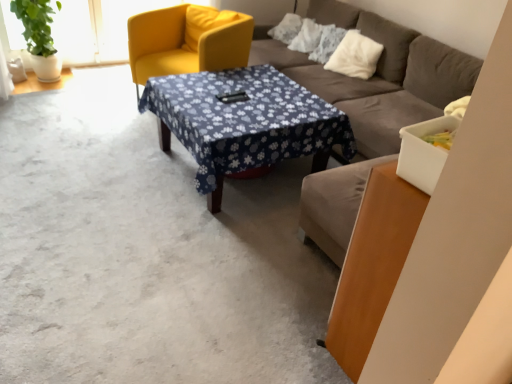
Question: From the image's perspective, is white fluffy pillow at upper right above or below brown fabric couch at center?

Choices:
 (A) below
 (B) above

Answer: (B)

Question: Is white fluffy pillow at upper right in front of or behind brown fabric couch at center in the image?

Choices:
 (A) front
 (B) behind

Answer: (B)

Question: Considering the real-world distances, which object is farthest from the matte yellow armchair at upper left?

Choices:
 (A) brown fabric couch at center
 (B) white fluffy pillow at upper right
 (C) blue floral fabric at center

Answer: (B)

Question: Based on their relative distances, which object is farther from the matte yellow armchair at upper left?

Choices:
 (A) blue floral fabric at center
 (B) white fluffy pillow at upper right
 (C) brown fabric couch at center

Answer: (B)